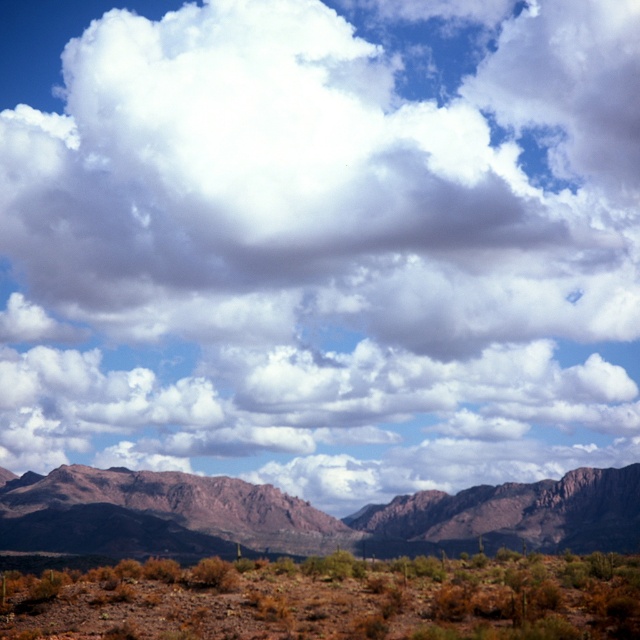
Between brown dirt at lower center and rugged rock mountain range at center, which one is positioned higher?

brown dirt at lower center is above.

Looking at this image, is brown dirt at lower center above rugged rock mountain range at center?

Yes.

Is point (436, 570) positioned in front of point (627, 474)?

Yes, it is.

Find the location of `brown dirt at lower center`. brown dirt at lower center is located at coordinates (332, 600).

Can you confirm if rugged rock mountain range at center is taller than rustic brown rock formation at center?

Incorrect, rugged rock mountain range at center's height is not larger of rustic brown rock formation at center's.

Identify the location of rugged rock mountain range at center. This screenshot has width=640, height=640. (308, 515).

Where is `rugged rock mountain range at center`? Image resolution: width=640 pixels, height=640 pixels. rugged rock mountain range at center is located at coordinates (308, 515).

Is brown dirt at lower center above rustic brown rock formation at center?

Correct, brown dirt at lower center is located above rustic brown rock formation at center.

Is point (237, 604) less distant than point (467, 541)?

Yes.

Locate an element on the screen. The image size is (640, 640). brown dirt at lower center is located at coordinates (332, 600).